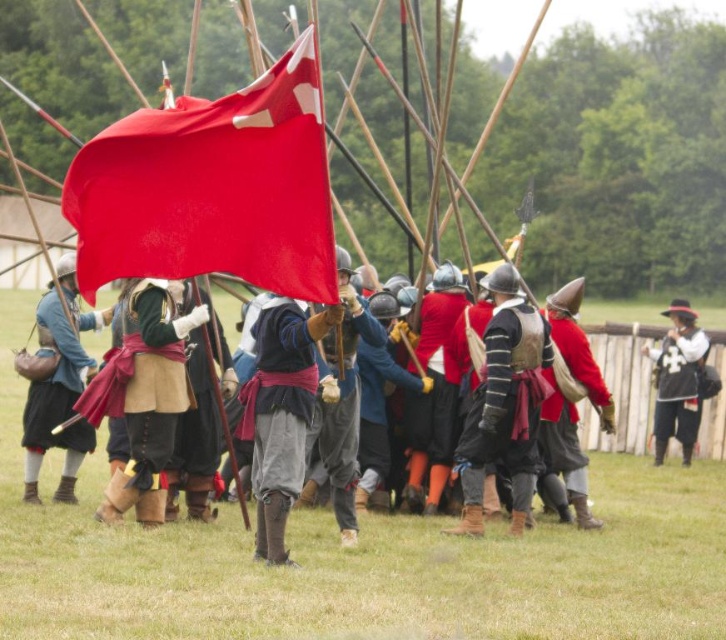
In the scene shown: Is smooth red flag at center bigger than matte leather bag at center?

Actually, smooth red flag at center might be smaller than matte leather bag at center.

Where is `smooth red flag at center`? This screenshot has width=726, height=640. smooth red flag at center is located at coordinates (212, 188).

At what (x,y) coordinates should I click in order to perform the action: click on smooth red flag at center. Please return your answer as a coordinate pair (x, y). Image resolution: width=726 pixels, height=640 pixels. Looking at the image, I should click on (212, 188).

Is matte red flag at center further to the viewer compared to matte leather bag at center?

No, matte red flag at center is in front of matte leather bag at center.

Can you confirm if matte red flag at center is thinner than matte leather bag at center?

No, matte red flag at center is not thinner than matte leather bag at center.

Does point (303, 340) lie in front of point (81, 388)?

Yes, it is.

Where is `matte red flag at center`? This screenshot has width=726, height=640. matte red flag at center is located at coordinates (138, 401).

Who is positioned more to the left, smooth red flag at center or smooth black vest at right?

smooth red flag at center

Is point (139, 188) positioned after point (690, 349)?

No, (139, 188) is closer to viewer.

Does point (101, 136) come behind point (656, 451)?

No, (101, 136) is closer to viewer.

I want to click on smooth red flag at center, so click(212, 188).